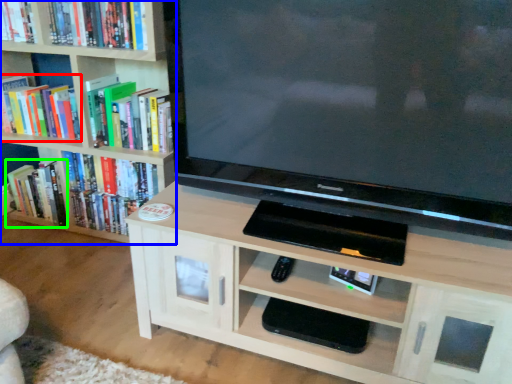
Question: Estimate the real-world distances between objects in this image. Which object is farther from book (highlighted by a red box), bookcase (highlighted by a blue box) or book (highlighted by a green box)?

Choices:
 (A) bookcase
 (B) book

Answer: (B)